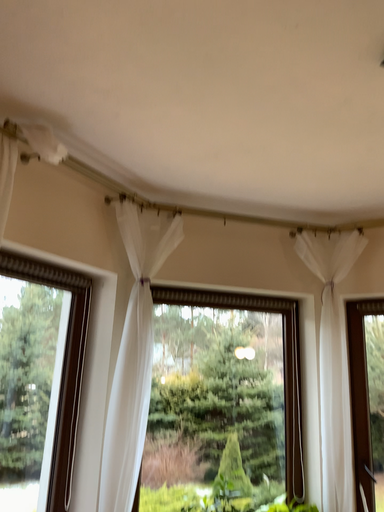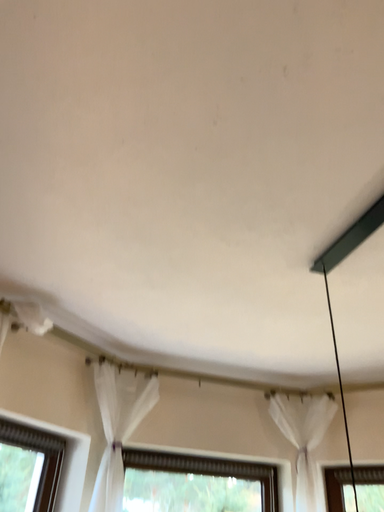
Question: How did the camera likely rotate when shooting the video?

Choices:
 (A) rotated upward
 (B) rotated downward

Answer: (A)